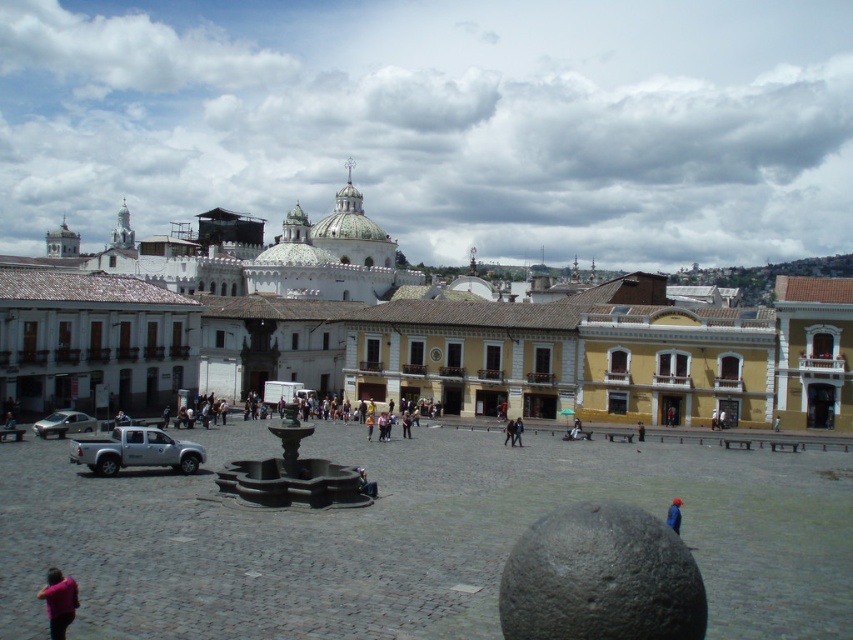
Question: Which object is the farthest from the blue fabric person at lower right?

Choices:
 (A) smooth concrete fountain at center
 (B) dark blue jeans at center
 (C) silver metallic truck at center-left

Answer: (B)

Question: In this image, where is white stucco building at center located relative to blue fabric person at lower right?

Choices:
 (A) right
 (B) left

Answer: (B)

Question: Is pink fabric person at lower left further to camera compared to blue fabric person at lower right?

Choices:
 (A) yes
 (B) no

Answer: (B)

Question: Can you confirm if pink fabric person at lower left is positioned below silver metallic car at lower left?

Choices:
 (A) no
 (B) yes

Answer: (B)

Question: Which point is closer to the camera?

Choices:
 (A) dark blue jeans at center
 (B) silver metallic car at lower left
 (C) white stucco building at center
 (D) pink fabric person at lower left

Answer: (D)

Question: Which object appears closest to the camera in this image?

Choices:
 (A) dark blue jeans at center
 (B) white stucco building at center
 (C) blue fabric person at lower right
 (D) silver metallic truck at center-left

Answer: (C)